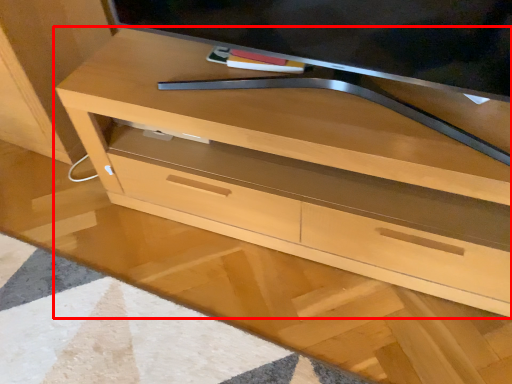
Question: From the image's perspective, considering the relative positions of chest of drawers (annotated by the red box) and television in the image provided, where is chest of drawers (annotated by the red box) located with respect to the staircase?

Choices:
 (A) below
 (B) above

Answer: (A)